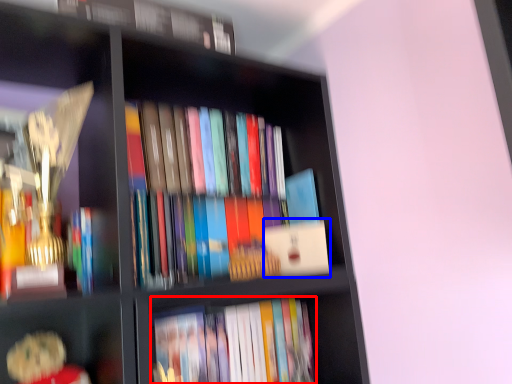
Question: Which of the following is the closest to the observer, book (highlighted by a red box) or paperback book (highlighted by a blue box)?

Choices:
 (A) book
 (B) paperback book

Answer: (A)